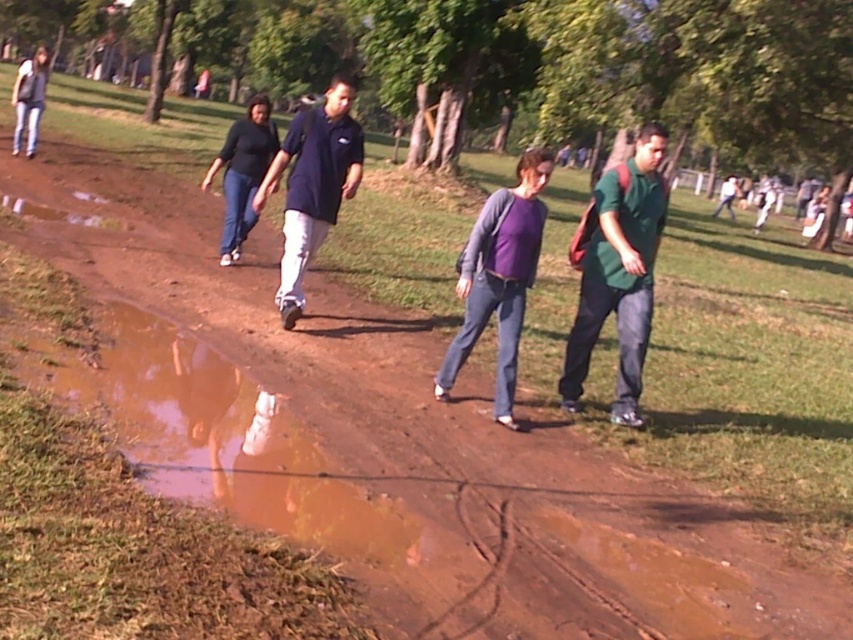
Who is shorter, green matte shirt at center or dark blue shirt at center?

dark blue shirt at center

Does green matte shirt at center lie in front of dark blue shirt at center?

Yes, green matte shirt at center is in front of dark blue shirt at center.

Is point (651, 228) positioned in front of point (283, 280)?

Yes, it is in front of point (283, 280).

Find the location of `green matte shirt at center`. green matte shirt at center is located at coordinates (618, 273).

Which of these two, brown muddy puddle at lower left or dark blue shirt at center, stands taller?

dark blue shirt at center is taller.

Is brown muddy puddle at lower left in front of dark blue shirt at center?

Result: Yes, it is in front of dark blue shirt at center.

Locate an element on the screen. This screenshot has height=640, width=853. brown muddy puddle at lower left is located at coordinates (225, 440).

Between brown muddy puddle at lower left and green matte shirt at center, which one has less height?

brown muddy puddle at lower left is shorter.

Can you confirm if brown muddy puddle at lower left is smaller than green matte shirt at center?

No.

Is point (206, 481) closer to viewer compared to point (630, 381)?

Yes, it is in front of point (630, 381).

This screenshot has width=853, height=640. I want to click on brown muddy puddle at lower left, so click(225, 440).